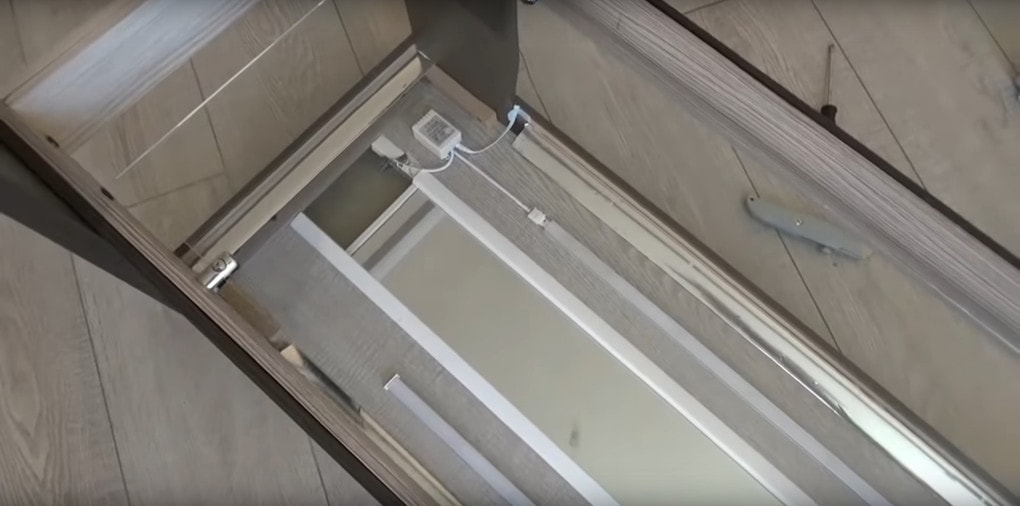
Where is `cord`? cord is located at coordinates (508, 194), (496, 138), (432, 165).